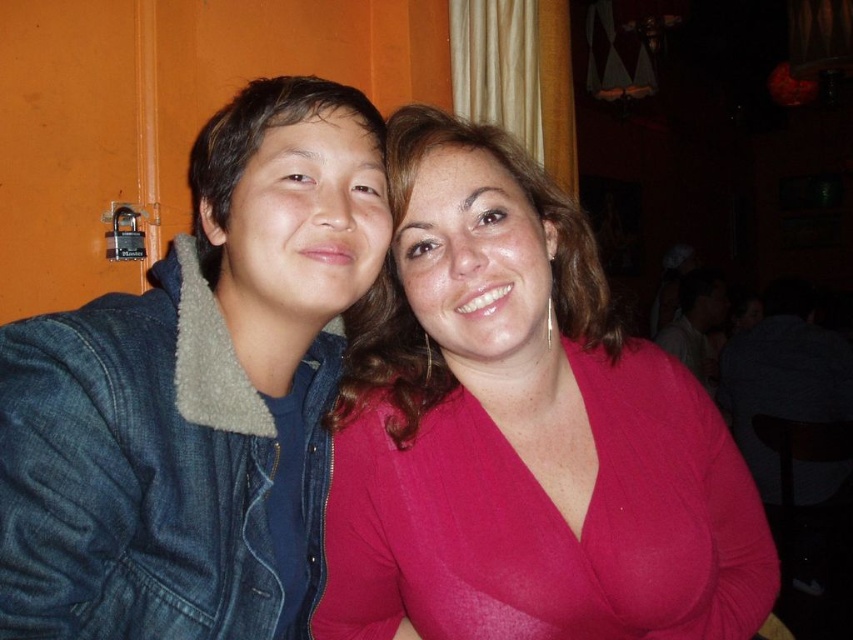
Question: Observing the image, what is the correct spatial positioning of matte pink blouse at center in reference to matte white shirt at upper right?

Choices:
 (A) right
 (B) left

Answer: (B)

Question: Considering the relative positions of matte pink blouse at center and denim jacket at left in the image provided, where is matte pink blouse at center located with respect to denim jacket at left?

Choices:
 (A) left
 (B) right

Answer: (B)

Question: Which of the following is the closest to the observer?

Choices:
 (A) (47, 440)
 (B) (689, 317)

Answer: (A)

Question: Which object is positioned closest to the denim jacket at left?

Choices:
 (A) matte white shirt at upper right
 (B) matte pink blouse at center

Answer: (B)

Question: In this image, where is matte pink blouse at center located relative to denim jacket at left?

Choices:
 (A) above
 (B) below

Answer: (B)

Question: Which object is the farthest from the matte white shirt at upper right?

Choices:
 (A) denim jacket at left
 (B) matte pink blouse at center

Answer: (A)